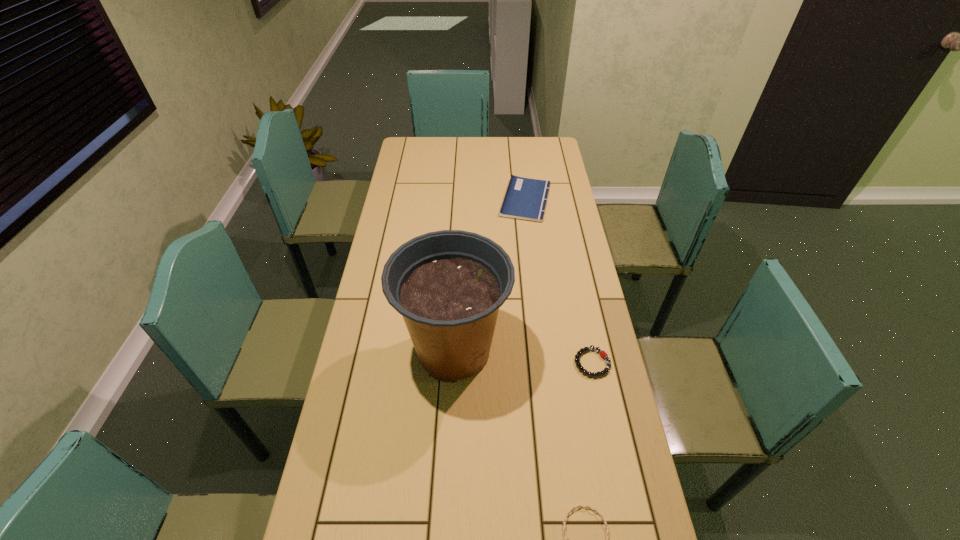
Identify which object is located as the second nearest to the taller bracelet. Please provide its 2D coordinates. Your answer should be formatted as a tuple, i.e. [(x, y)], where the tuple contains the x and y coordinates of a point satisfying the conditions above.

[(587, 506)]

Select which object is the third closest to the paperback book. Please provide its 2D coordinates. Your answer should be formatted as a tuple, i.e. [(x, y)], where the tuple contains the x and y coordinates of a point satisfying the conditions above.

[(587, 506)]

Where is `free location that satisfies the following two spatial constraints: 1. on the back side of the tallest object; 2. on the left side of the third shortest object`? Image resolution: width=960 pixels, height=540 pixels. free location that satisfies the following two spatial constraints: 1. on the back side of the tallest object; 2. on the left side of the third shortest object is located at coordinates (462, 200).